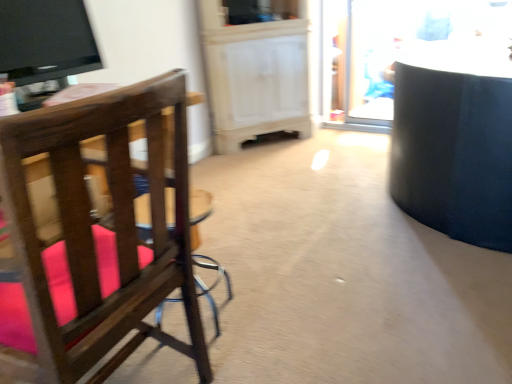
Question: Considering the relative positions of wooden bar stool at center and transparent glass door at upper right in the image provided, is wooden bar stool at center behind transparent glass door at upper right?

Choices:
 (A) no
 (B) yes

Answer: (A)

Question: Is wooden bar stool at center to the right of transparent glass door at upper right from the viewer's perspective?

Choices:
 (A) no
 (B) yes

Answer: (A)

Question: Does wooden bar stool at center appear on the left side of transparent glass door at upper right?

Choices:
 (A) no
 (B) yes

Answer: (B)

Question: From a real-world perspective, is wooden bar stool at center beneath transparent glass door at upper right?

Choices:
 (A) no
 (B) yes

Answer: (B)

Question: Could you tell me if wooden bar stool at center is turned towards transparent glass door at upper right?

Choices:
 (A) no
 (B) yes

Answer: (A)

Question: Is black glossy tv at upper left wider or thinner than wooden bar stool at center?

Choices:
 (A) thin
 (B) wide

Answer: (A)

Question: From a real-world perspective, is black glossy tv at upper left positioned above or below wooden bar stool at center?

Choices:
 (A) above
 (B) below

Answer: (A)

Question: Is black glossy tv at upper left in front of or behind wooden bar stool at center in the image?

Choices:
 (A) front
 (B) behind

Answer: (B)

Question: Considering the positions of black glossy tv at upper left and wooden bar stool at center in the image, is black glossy tv at upper left taller or shorter than wooden bar stool at center?

Choices:
 (A) short
 (B) tall

Answer: (A)

Question: From the image's perspective, is transparent glass door at upper right positioned above or below wooden bar stool at center?

Choices:
 (A) below
 (B) above

Answer: (B)

Question: Considering their positions, is transparent glass door at upper right located in front of or behind wooden bar stool at center?

Choices:
 (A) front
 (B) behind

Answer: (B)

Question: Considering the positions of transparent glass door at upper right and wooden bar stool at center in the image, is transparent glass door at upper right wider or thinner than wooden bar stool at center?

Choices:
 (A) wide
 (B) thin

Answer: (B)

Question: Is transparent glass door at upper right situated inside wooden bar stool at center or outside?

Choices:
 (A) inside
 (B) outside

Answer: (B)

Question: Is transparent glass door at upper right bigger or smaller than black glossy tv at upper left?

Choices:
 (A) big
 (B) small

Answer: (A)

Question: Is transparent glass door at upper right taller or shorter than black glossy tv at upper left?

Choices:
 (A) tall
 (B) short

Answer: (A)